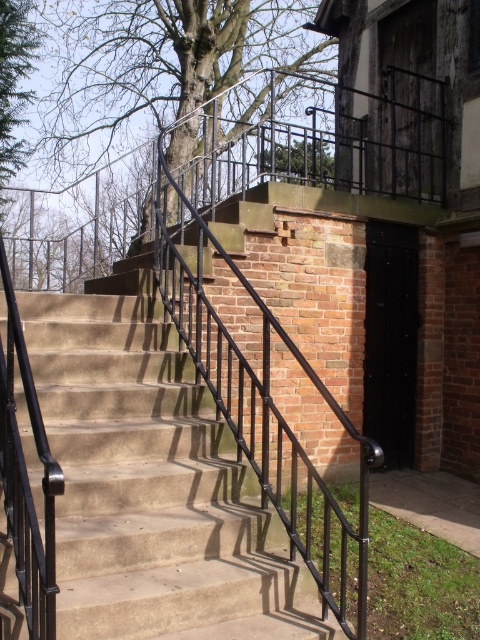
You are standing on the outdoor stairs leading to the building and looking towards the brick wall. There is a point marked at coordinates (158, 67). What object does this point correspond to?

The point corresponds to the bare wood tree at upper center.

You are standing at the bottom of the stairs and want to walk towards the building entrance. There are two trees in your view, a bare wood tree at upper center and a green leafy tree at upper left. Which tree is closer to you?

The bare wood tree at upper center is 4.39 feet away from the green leafy tree at upper left, so the green leafy tree at upper left is closer to you.